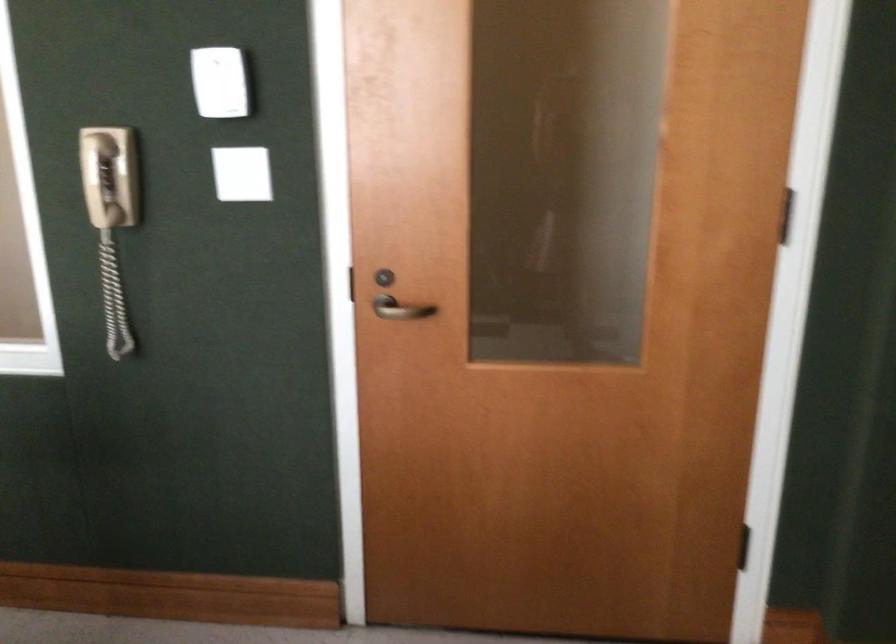
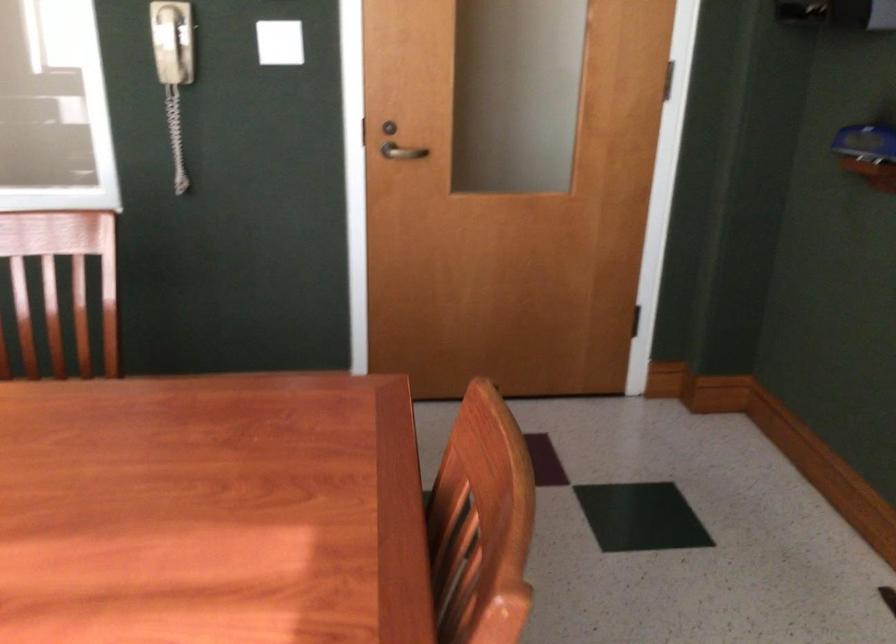
Locate, in the second image, the point that corresponds to point (97, 178) in the first image.

(171, 41)